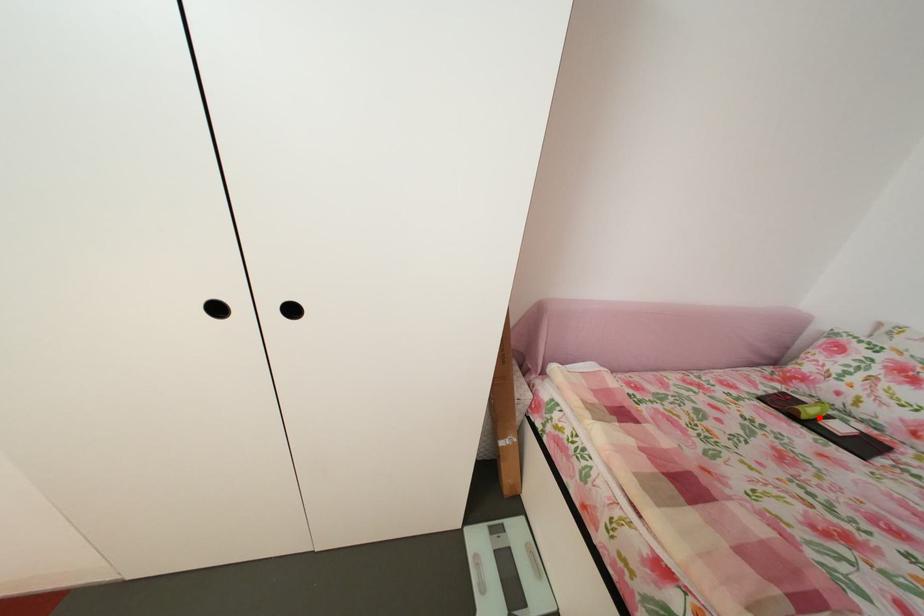
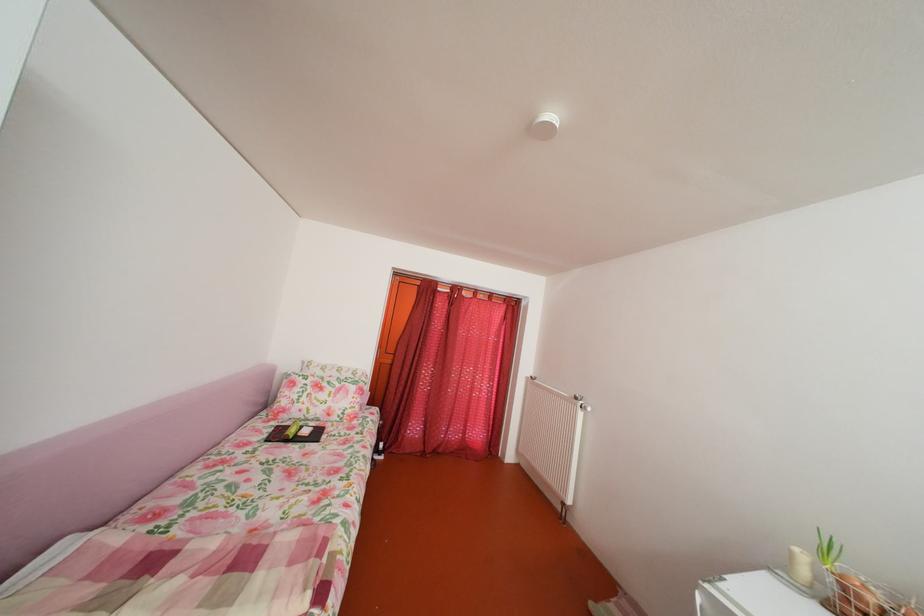
The point at the highlighted location is marked in the first image. Where is the corresponding point in the second image?

(304, 438)